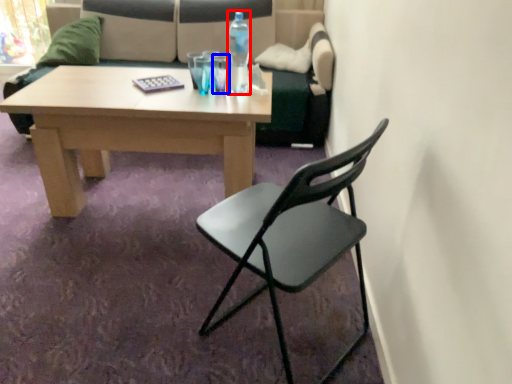
Question: Which point is further to the camera, bottle (highlighted by a red box) or coffee cup (highlighted by a blue box)?

Choices:
 (A) bottle
 (B) coffee cup

Answer: (B)